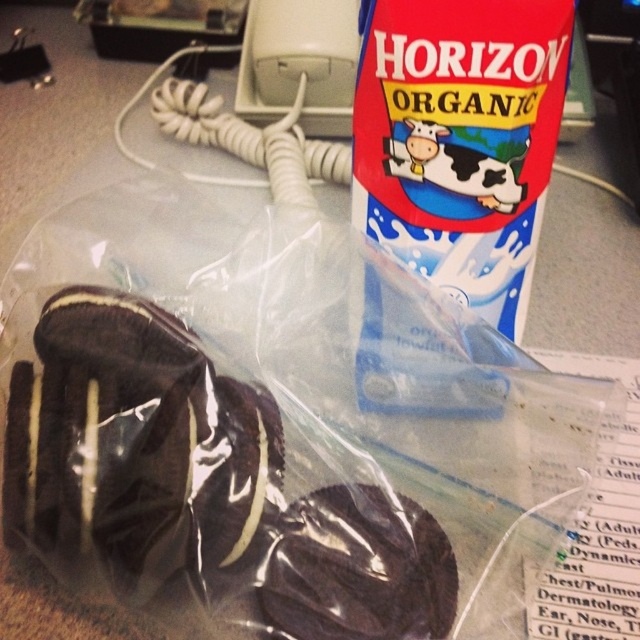
Which is more to the right, chocolate-coated wafer at center or blue paper carton at upper right?

Positioned to the right is blue paper carton at upper right.

Is chocolate-coated wafer at center smaller than blue paper carton at upper right?

Correct, chocolate-coated wafer at center occupies less space than blue paper carton at upper right.

Is point (157, 541) behind point (448, 150)?

No.

This screenshot has width=640, height=640. Find the location of `chocolate-coated wafer at center`. chocolate-coated wafer at center is located at coordinates (198, 486).